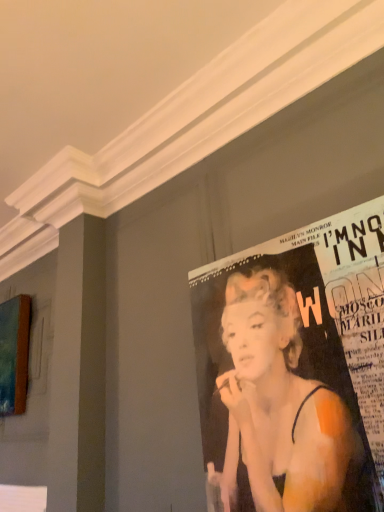
The height and width of the screenshot is (512, 384). Describe the element at coordinates (295, 369) in the screenshot. I see `matte paper poster at upper right` at that location.

At what (x,y) coordinates should I click in order to perform the action: click on matte paper poster at upper right. Please return your answer as a coordinate pair (x, y). This screenshot has width=384, height=512. Looking at the image, I should click on (295, 369).

Describe the element at coordinates (14, 354) in the screenshot. I see `teal canvas painting at left` at that location.

Measure the distance between teal canvas painting at left and camera.

3.30 meters.

This screenshot has height=512, width=384. I want to click on teal canvas painting at left, so click(x=14, y=354).

Locate an element on the screen. The image size is (384, 512). matte paper poster at upper right is located at coordinates (295, 369).

Can you confirm if teal canvas painting at left is positioned to the right of matte paper poster at upper right?

Incorrect, teal canvas painting at left is not on the right side of matte paper poster at upper right.

Is the depth of teal canvas painting at left greater than that of matte paper poster at upper right?

Yes, teal canvas painting at left is further from the viewer.

Is point (7, 345) farther from camera compared to point (362, 453)?

Yes, it is.

Looking at this image, from the image's perspective, is teal canvas painting at left above or below matte paper poster at upper right?

teal canvas painting at left is below matte paper poster at upper right.

From a real-world perspective, is teal canvas painting at left located higher than matte paper poster at upper right?

Yes.

In terms of width, does teal canvas painting at left look wider or thinner when compared to matte paper poster at upper right?

In the image, teal canvas painting at left appears to be wider than matte paper poster at upper right.

Can you confirm if teal canvas painting at left is taller than matte paper poster at upper right?

No, teal canvas painting at left is not taller than matte paper poster at upper right.

Considering the relative sizes of teal canvas painting at left and matte paper poster at upper right in the image provided, is teal canvas painting at left smaller than matte paper poster at upper right?

Incorrect, teal canvas painting at left is not smaller in size than matte paper poster at upper right.

Choose the correct answer: Is teal canvas painting at left inside matte paper poster at upper right or outside it?

teal canvas painting at left is outside matte paper poster at upper right.

Does teal canvas painting at left touch matte paper poster at upper right?

There is a gap between teal canvas painting at left and matte paper poster at upper right.

Is teal canvas painting at left oriented towards matte paper poster at upper right?

No, teal canvas painting at left is not facing towards matte paper poster at upper right.

Where is `poster to the right of teal canvas painting at left`? This screenshot has width=384, height=512. poster to the right of teal canvas painting at left is located at coordinates (295, 369).

In the image, is matte paper poster at upper right on the left side or the right side of teal canvas painting at left?

matte paper poster at upper right is to the right of teal canvas painting at left.

Considering the positions of objects matte paper poster at upper right and teal canvas painting at left in the image provided, who is in front, matte paper poster at upper right or teal canvas painting at left?

matte paper poster at upper right.

Is point (248, 407) closer or farther from the camera than point (8, 381)?

Point (248, 407) is positioned closer to the camera compared to point (8, 381).

From the image's perspective, who appears lower, matte paper poster at upper right or teal canvas painting at left?

teal canvas painting at left, from the image's perspective.

From a real-world perspective, which is physically below, matte paper poster at upper right or teal canvas painting at left?

matte paper poster at upper right.

Considering the relative sizes of matte paper poster at upper right and teal canvas painting at left in the image provided, is matte paper poster at upper right wider than teal canvas painting at left?

No, matte paper poster at upper right is not wider than teal canvas painting at left.

Is matte paper poster at upper right taller or shorter than teal canvas painting at left?

In the image, matte paper poster at upper right appears to be taller than teal canvas painting at left.

Considering the sizes of objects matte paper poster at upper right and teal canvas painting at left in the image provided, who is smaller, matte paper poster at upper right or teal canvas painting at left?

With smaller size is matte paper poster at upper right.

Is matte paper poster at upper right completely or partially outside of teal canvas painting at left?

Absolutely, matte paper poster at upper right is external to teal canvas painting at left.

Is matte paper poster at upper right far away from teal canvas painting at left?

Absolutely, matte paper poster at upper right is distant from teal canvas painting at left.

Does matte paper poster at upper right turn towards teal canvas painting at left?

No.

What's the angular difference between matte paper poster at upper right and teal canvas painting at left's facing directions?

matte paper poster at upper right and teal canvas painting at left are facing 0.116 degrees away from each other.

You are a GUI agent. You are given a task and a screenshot of the screen. Output one action in this format:
    pyautogui.click(x=<x>, y=<y>)
    Task: Click on the advertisement located on the left of matte paper poster at upper right
    The image size is (384, 512).
    Given the screenshot: What is the action you would take?
    pyautogui.click(x=14, y=354)

Locate an element on the screen. The width and height of the screenshot is (384, 512). advertisement above the matte paper poster at upper right (from a real-world perspective) is located at coordinates (14, 354).

Find the location of a particular element. poster in front of the teal canvas painting at left is located at coordinates (295, 369).